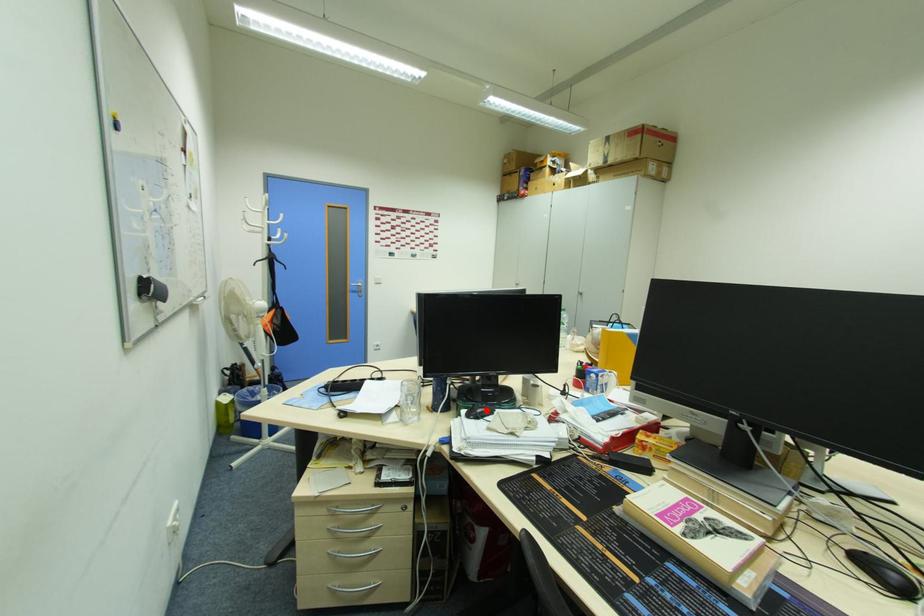
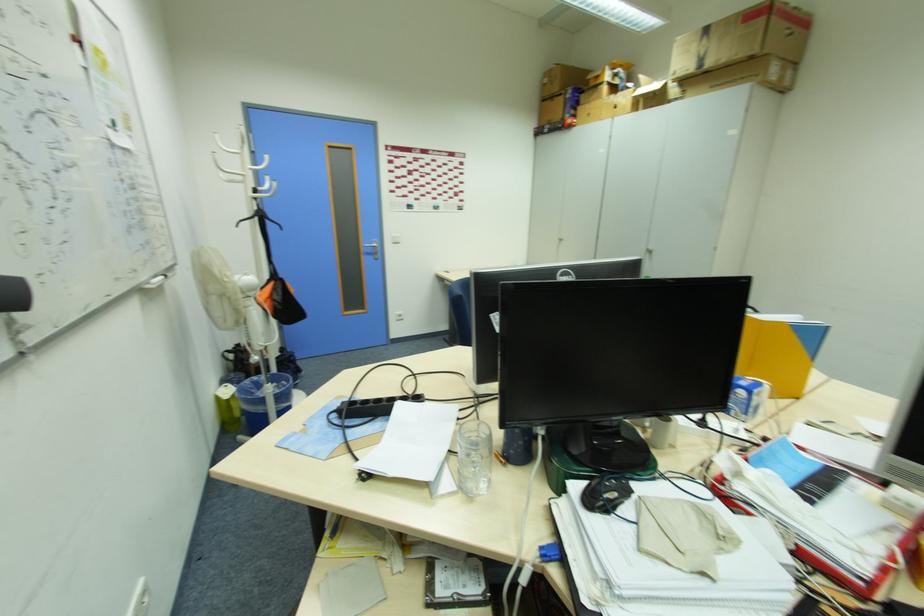
Locate, in the second image, the point that corresponds to the highlighted location in the first image.

(619, 496)